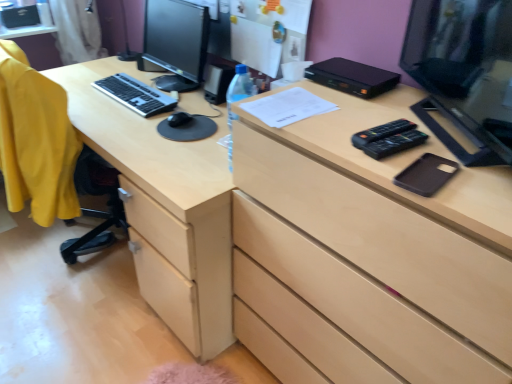
Find the location of a particular element. free spot in front of matte black monitor at center left, the 1th computer monitor from the left is located at coordinates (160, 107).